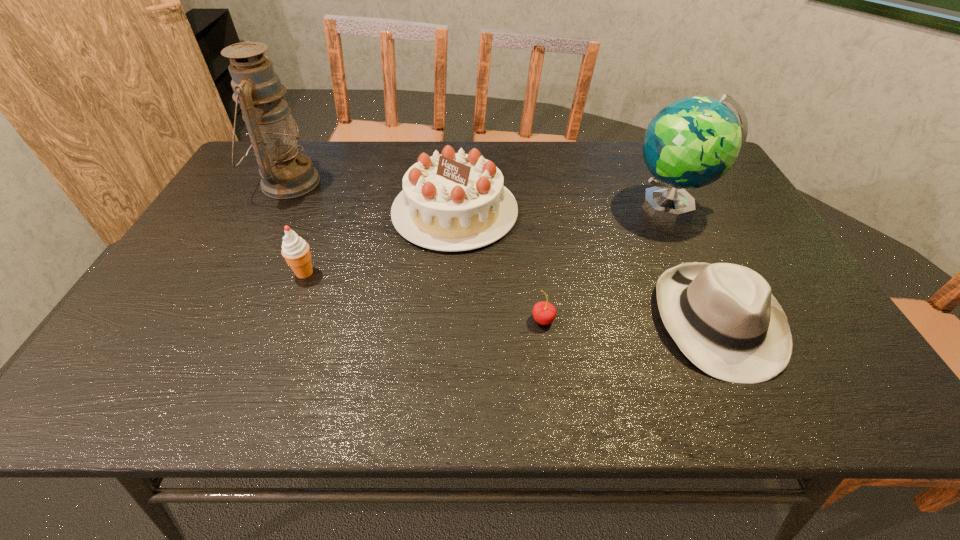
The height and width of the screenshot is (540, 960). I want to click on vacant space situated on the front surface of the second tallest object, so click(541, 204).

You are a GUI agent. You are given a task and a screenshot of the screen. Output one action in this format:
    pyautogui.click(x=<x>, y=<y>)
    Task: Click on the free space located on the front surface of the second tallest object
    
    Given the screenshot: What is the action you would take?
    pyautogui.click(x=507, y=204)

At what (x,y) coordinates should I click in order to perform the action: click on vacant space located 0.150m on the left of the fourth object from right to left. Please return your answer as a coordinate pair (x, y). Looking at the image, I should click on (339, 212).

At what (x,y) coordinates should I click in order to perform the action: click on free space located 0.370m on the right of the icecream. Please return your answer as a coordinate pair (x, y). This screenshot has height=540, width=960. Looking at the image, I should click on (468, 273).

The height and width of the screenshot is (540, 960). Identify the location of vacant space located 0.050m on the front-facing side of the fedora. (758, 408).

I want to click on vacant space located on the back of the shortest object, so click(x=536, y=261).

I want to click on oil lamp that is positioned at the far edge, so click(285, 173).

Find the location of a particular element. The width and height of the screenshot is (960, 540). birthday cake located in the far edge section of the desktop is located at coordinates (451, 201).

Locate an element on the screen. The image size is (960, 540). object at the near edge is located at coordinates (723, 317).

Locate an element on the screen. This screenshot has width=960, height=540. object that is at the left edge is located at coordinates (285, 173).